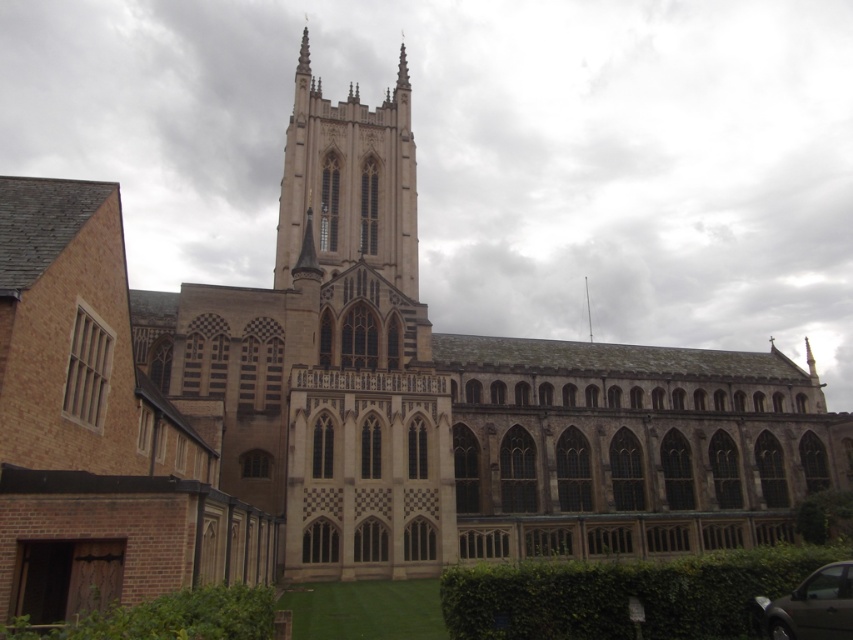
You are standing at the camera position and want to take a photo of the beige stone tower at center. If your camera can capture objects up to 200 feet away, will you be able to capture the entire tower in the photo?

The beige stone tower at center and camera are 216.27 feet apart, which exceeds the camera maximum range of 200 feet. Therefore, the camera cannot capture the entire tower in the photo.

You are a photographer standing in front of the church. You want to capture a photo that includes both the beige stone tower at center and the metallic silver car at lower right. Based on their positions, which object should appear higher in the photo?

The beige stone tower at center appears higher in the photo because it is located above the metallic silver car at lower right.